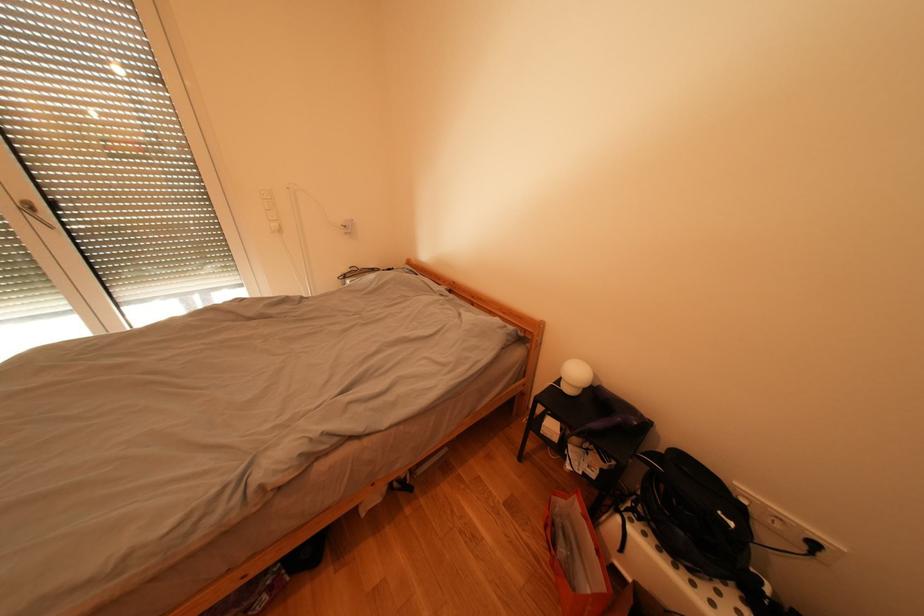
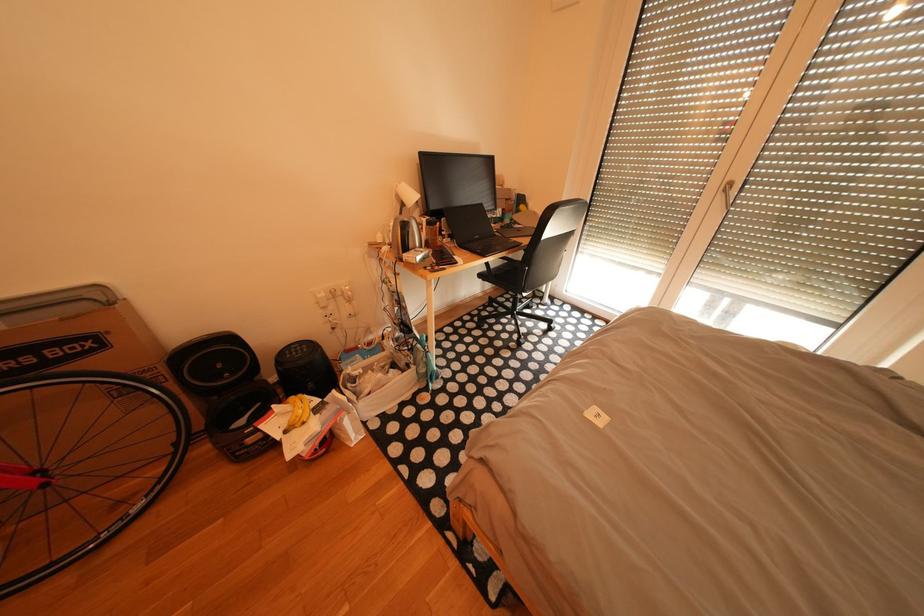
The images are taken continuously from a first-person perspective. In which direction is your viewpoint rotating?

The rotation direction of the camera is left-down.